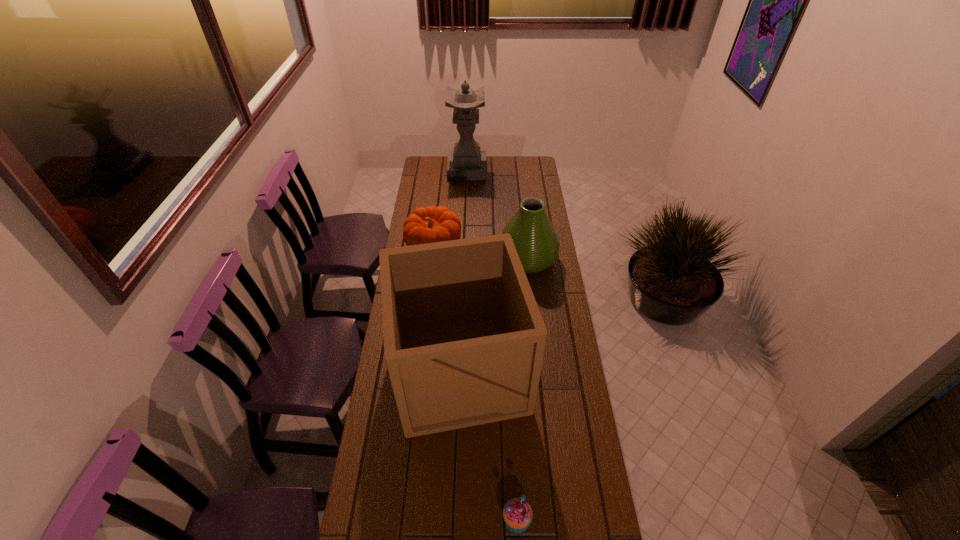
Locate an element on the screen. free space that satisfies the following two spatial constraints: 1. at the front opening of the tallest object; 2. on the back side of the third shortest object is located at coordinates (464, 259).

Locate an element on the screen. Image resolution: width=960 pixels, height=540 pixels. vacant space that satisfies the following two spatial constraints: 1. on the front side of the pumpkin; 2. on the left side of the third shortest object is located at coordinates (432, 259).